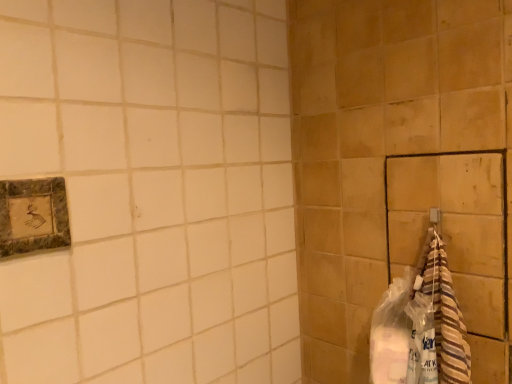
Image resolution: width=512 pixels, height=384 pixels. Describe the element at coordinates (33, 216) in the screenshot. I see `marble-like stone picture frame at upper left` at that location.

Find the location of a particular element. marble-like stone picture frame at upper left is located at coordinates (33, 216).

The image size is (512, 384). Describe the element at coordinates (421, 326) in the screenshot. I see `striped towel at right` at that location.

Locate an element on the screen. The height and width of the screenshot is (384, 512). striped towel at right is located at coordinates (421, 326).

At what (x,y) coordinates should I click in order to perform the action: click on marble-like stone picture frame at upper left. Please return your answer as a coordinate pair (x, y). Image resolution: width=512 pixels, height=384 pixels. Looking at the image, I should click on (33, 216).

Considering the relative positions of marble-like stone picture frame at upper left and striped towel at right in the image provided, is marble-like stone picture frame at upper left to the left of striped towel at right from the viewer's perspective?

Indeed, marble-like stone picture frame at upper left is positioned on the left side of striped towel at right.

Is marble-like stone picture frame at upper left closer to the viewer compared to striped towel at right?

Yes, it is.

Considering the positions of point (16, 215) and point (428, 244), is point (16, 215) closer or farther from the camera than point (428, 244)?

Point (16, 215).

In the scene shown: From the image's perspective, is marble-like stone picture frame at upper left above striped towel at right?

Correct, marble-like stone picture frame at upper left appears higher than striped towel at right in the image.

From a real-world perspective, which is physically below, marble-like stone picture frame at upper left or striped towel at right?

striped towel at right, from a real-world perspective.

Is marble-like stone picture frame at upper left wider or thinner than striped towel at right?

In the image, marble-like stone picture frame at upper left appears to be more narrow than striped towel at right.

Does marble-like stone picture frame at upper left have a greater height compared to striped towel at right?

In fact, marble-like stone picture frame at upper left may be shorter than striped towel at right.

In terms of size, does marble-like stone picture frame at upper left appear bigger or smaller than striped towel at right?

Considering their sizes, marble-like stone picture frame at upper left takes up less space than striped towel at right.

Is marble-like stone picture frame at upper left not within striped towel at right?

That's correct, marble-like stone picture frame at upper left is outside of striped towel at right.

Are marble-like stone picture frame at upper left and striped towel at right far apart?

No, there isn't a large distance between marble-like stone picture frame at upper left and striped towel at right.

Is marble-like stone picture frame at upper left facing away from striped towel at right?

marble-like stone picture frame at upper left does not have its back to striped towel at right.

What's the angular difference between marble-like stone picture frame at upper left and striped towel at right's facing directions?

The facing directions of marble-like stone picture frame at upper left and striped towel at right are 90 degrees apart.

The width and height of the screenshot is (512, 384). I want to click on material below the marble-like stone picture frame at upper left (from the image's perspective), so click(421, 326).

Which is more to the left, striped towel at right or marble-like stone picture frame at upper left?

Positioned to the left is marble-like stone picture frame at upper left.

Is striped towel at right closer to camera compared to marble-like stone picture frame at upper left?

No.

Is point (388, 381) behind point (8, 194)?

That is True.

From the image's perspective, is striped towel at right positioned above or below marble-like stone picture frame at upper left?

striped towel at right is below marble-like stone picture frame at upper left.

From a real-world perspective, is striped towel at right located higher than marble-like stone picture frame at upper left?

No.

In terms of width, does striped towel at right look wider or thinner when compared to marble-like stone picture frame at upper left?

striped towel at right is wider than marble-like stone picture frame at upper left.

Does striped towel at right have a greater height compared to marble-like stone picture frame at upper left?

Yes.

In the scene shown: Which of these two, striped towel at right or marble-like stone picture frame at upper left, is smaller?

Smaller between the two is marble-like stone picture frame at upper left.

Is striped towel at right outside of marble-like stone picture frame at upper left?

Indeed, striped towel at right is completely outside marble-like stone picture frame at upper left.

Is striped towel at right far away from marble-like stone picture frame at upper left?

No, striped towel at right is not far away from marble-like stone picture frame at upper left.

Is striped towel at right facing towards marble-like stone picture frame at upper left?

No, striped towel at right is not aimed at marble-like stone picture frame at upper left.

At what (x,y) coordinates should I click in order to perform the action: click on picture frame on the left side of striped towel at right. Please return your answer as a coordinate pair (x, y). The height and width of the screenshot is (384, 512). Looking at the image, I should click on (33, 216).

Find the location of a particular element. The height and width of the screenshot is (384, 512). picture frame above the striped towel at right (from the image's perspective) is located at coordinates (33, 216).

Locate an element on the screen. The image size is (512, 384). material lying on the right of marble-like stone picture frame at upper left is located at coordinates (421, 326).